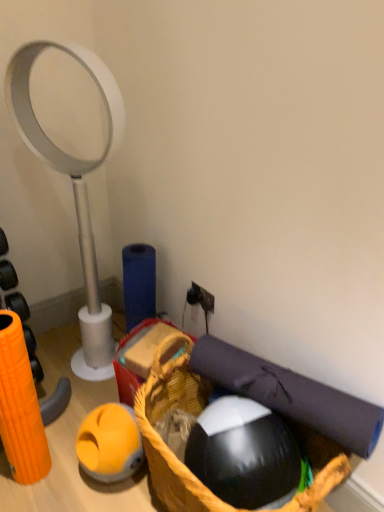
This screenshot has height=512, width=384. Identify the location of woven brown basket at lower center. (161, 438).

Identify the location of black rubber ball at lower center. This screenshot has width=384, height=512. (244, 454).

What is the approximate height of dark blue fabric yoga mat at lower right?

dark blue fabric yoga mat at lower right is 9.44 inches tall.

Where is `white plastic magnifying glass at left`? The height and width of the screenshot is (512, 384). white plastic magnifying glass at left is located at coordinates (74, 188).

From a real-world perspective, between white plastic magnifying glass at left and woven brown basket at lower center, who is vertically higher?

From a 3D spatial view, white plastic magnifying glass at left is above.

Considering the positions of objects white plastic magnifying glass at left and woven brown basket at lower center in the image provided, who is more to the right, white plastic magnifying glass at left or woven brown basket at lower center?

woven brown basket at lower center.

What's the angular difference between white plastic magnifying glass at left and woven brown basket at lower center's facing directions?

88.9 degrees separate the facing orientations of white plastic magnifying glass at left and woven brown basket at lower center.

From the image's perspective, is white plastic magnifying glass at left positioned above or below woven brown basket at lower center?

From the image's perspective, white plastic magnifying glass at left appears above woven brown basket at lower center.

Does point (215, 469) lie behind point (310, 405)?

No.

From the image's perspective, is black rubber ball at lower center under dark blue fabric yoga mat at lower right?

Yes, from the image's perspective, black rubber ball at lower center is below dark blue fabric yoga mat at lower right.

How different are the orientations of black rubber ball at lower center and dark blue fabric yoga mat at lower right in degrees?

They differ by 11.7 degrees in their facing directions.

Would you say dark blue fabric yoga mat at lower right is part of black rubber ball at lower center's contents?

No, dark blue fabric yoga mat at lower right is not surrounded by black rubber ball at lower center.

Is dark blue fabric yoga mat at lower right oriented away from woven brown basket at lower center?

Yes.

Is dark blue fabric yoga mat at lower right with woven brown basket at lower center?

No, dark blue fabric yoga mat at lower right is not next to woven brown basket at lower center.

Is dark blue fabric yoga mat at lower right to the left or to the right of woven brown basket at lower center in the image?

dark blue fabric yoga mat at lower right is to the right of woven brown basket at lower center.

Locate an element on the screen. yoga mat above the woven brown basket at lower center (from the image's perspective) is located at coordinates (290, 394).

From the image's perspective, which one is positioned higher, black rubber ball at lower center or woven brown basket at lower center?

black rubber ball at lower center.

The width and height of the screenshot is (384, 512). Identify the location of ball behind the woven brown basket at lower center. (244, 454).

Based on their sizes in the image, would you say black rubber ball at lower center is bigger or smaller than woven brown basket at lower center?

Clearly, black rubber ball at lower center is smaller in size than woven brown basket at lower center.

From a real-world perspective, is black rubber ball at lower center on top of woven brown basket at lower center?

Correct, in the physical world, black rubber ball at lower center is higher than woven brown basket at lower center.

Considering the relative sizes of woven brown basket at lower center and white plastic magnifying glass at left in the image provided, is woven brown basket at lower center thinner than white plastic magnifying glass at left?

In fact, woven brown basket at lower center might be wider than white plastic magnifying glass at left.

From the image's perspective, would you say woven brown basket at lower center is positioned over white plastic magnifying glass at left?

No, from the image's perspective, woven brown basket at lower center is not over white plastic magnifying glass at left.

Which is behind, point (343, 478) or point (49, 161)?

Point (49, 161)

You are a GUI agent. You are given a task and a screenshot of the screen. Output one action in this format:
    pyautogui.click(x=<x>, y=<y>)
    Task: Click on the basket located in front of the white plastic magnifying glass at left
    The height and width of the screenshot is (512, 384).
    Given the screenshot: What is the action you would take?
    pyautogui.click(x=161, y=438)

Can you confirm if dark blue fabric yoga mat at lower right is wider than black rubber ball at lower center?

In fact, dark blue fabric yoga mat at lower right might be narrower than black rubber ball at lower center.

Are dark blue fabric yoga mat at lower right and black rubber ball at lower center far apart?

dark blue fabric yoga mat at lower right is near black rubber ball at lower center, not far away.

This screenshot has height=512, width=384. What are the coordinates of `ball on the left side of dark blue fabric yoga mat at lower right` in the screenshot? It's located at (244, 454).

Can you confirm if dark blue fabric yoga mat at lower right is taller than black rubber ball at lower center?

Incorrect, the height of dark blue fabric yoga mat at lower right is not larger of that of black rubber ball at lower center.

Is white plastic magnifying glass at left at the back of black rubber ball at lower center?

No.

Between black rubber ball at lower center and white plastic magnifying glass at left, which one has smaller size?

Smaller between the two is black rubber ball at lower center.

Considering the points (227, 469) and (28, 88), which point is behind, point (227, 469) or point (28, 88)?

Positioned behind is point (28, 88).

Image resolution: width=384 pixels, height=512 pixels. Identify the location of magnifying glass on the left of woven brown basket at lower center. (74, 188).

This screenshot has width=384, height=512. I want to click on ball in front of the dark blue fabric yoga mat at lower right, so (244, 454).

Looking at the image, which one is located further to black rubber ball at lower center, woven brown basket at lower center or white plastic magnifying glass at left?

white plastic magnifying glass at left.

From the picture: Which object lies nearer to the anchor point dark blue fabric yoga mat at lower right, black rubber ball at lower center or woven brown basket at lower center?

black rubber ball at lower center is positioned closer to the anchor dark blue fabric yoga mat at lower right.

Which object lies further to the anchor point woven brown basket at lower center, white plastic magnifying glass at left or black rubber ball at lower center?

white plastic magnifying glass at left is further to woven brown basket at lower center.

When comparing their distances from woven brown basket at lower center, does black rubber ball at lower center or white plastic magnifying glass at left seem further?

white plastic magnifying glass at left is positioned further to the anchor woven brown basket at lower center.

From the picture: When comparing their distances from dark blue fabric yoga mat at lower right, does white plastic magnifying glass at left or black rubber ball at lower center seem further?

The object further to dark blue fabric yoga mat at lower right is white plastic magnifying glass at left.

Looking at the image, which one is located further to woven brown basket at lower center, black rubber ball at lower center or dark blue fabric yoga mat at lower right?

Among the two, dark blue fabric yoga mat at lower right is located further to woven brown basket at lower center.

Considering their positions, is dark blue fabric yoga mat at lower right positioned closer to woven brown basket at lower center than black rubber ball at lower center?

black rubber ball at lower center is positioned closer to the anchor woven brown basket at lower center.

Estimate the real-world distances between objects in this image. Which object is closer to dark blue fabric yoga mat at lower right, black rubber ball at lower center or white plastic magnifying glass at left?

black rubber ball at lower center.

Where is `basket situated between white plastic magnifying glass at left and dark blue fabric yoga mat at lower right from left to right`? This screenshot has height=512, width=384. basket situated between white plastic magnifying glass at left and dark blue fabric yoga mat at lower right from left to right is located at coordinates (161, 438).

Find the location of `ball between white plastic magnifying glass at left and woven brown basket at lower center in the up-down direction`. ball between white plastic magnifying glass at left and woven brown basket at lower center in the up-down direction is located at coordinates (244, 454).

Where is `ball that lies between dark blue fabric yoga mat at lower right and woven brown basket at lower center from top to bottom`? Image resolution: width=384 pixels, height=512 pixels. ball that lies between dark blue fabric yoga mat at lower right and woven brown basket at lower center from top to bottom is located at coordinates point(244,454).

What are the coordinates of `ball located between white plastic magnifying glass at left and dark blue fabric yoga mat at lower right in the left-right direction` in the screenshot? It's located at (244, 454).